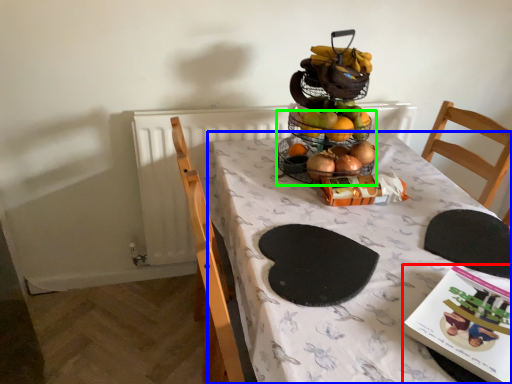
Question: Based on their relative distances, which object is farther from book (highlighted by a red box)? Choose from table (highlighted by a blue box) and basket (highlighted by a green box).

Choices:
 (A) table
 (B) basket

Answer: (B)